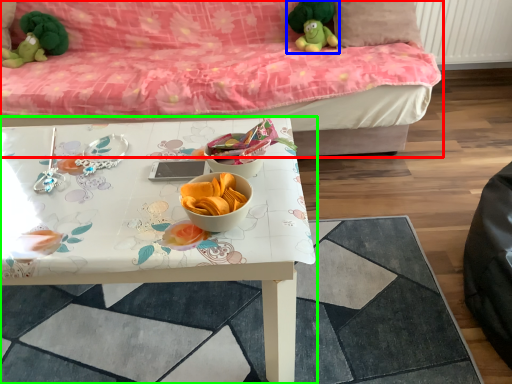
Question: Based on their relative distances, which object is nearer to studio couch (highlighted by a red box)? Choose from toy (highlighted by a blue box) and table (highlighted by a green box).

Choices:
 (A) toy
 (B) table

Answer: (A)